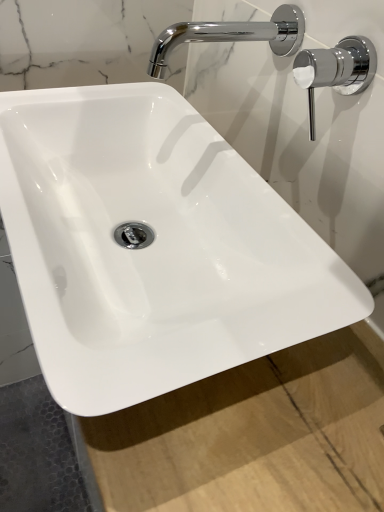
Question: From the image's perspective, is chrome/metallic faucet at upper right above or below chrome/metallic faucet at upper right?

Choices:
 (A) below
 (B) above

Answer: (A)

Question: From their relative heights in the image, would you say chrome/metallic faucet at upper right is taller or shorter than chrome/metallic faucet at upper right?

Choices:
 (A) tall
 (B) short

Answer: (B)

Question: Is chrome/metallic faucet at upper right inside or outside of chrome/metallic faucet at upper right?

Choices:
 (A) outside
 (B) inside

Answer: (A)

Question: Is point (271, 42) positioned closer to the camera than point (317, 58)?

Choices:
 (A) farther
 (B) closer

Answer: (A)

Question: From a real-world perspective, relative to chrome/metallic faucet at upper right, is chrome/metallic faucet at upper right vertically above or below?

Choices:
 (A) below
 (B) above

Answer: (B)

Question: Considering the relative positions of chrome/metallic faucet at upper right and chrome/metallic faucet at upper right in the image provided, is chrome/metallic faucet at upper right to the left or to the right of chrome/metallic faucet at upper right?

Choices:
 (A) left
 (B) right

Answer: (A)

Question: Looking at the image, does chrome/metallic faucet at upper right seem bigger or smaller compared to chrome/metallic faucet at upper right?

Choices:
 (A) small
 (B) big

Answer: (B)